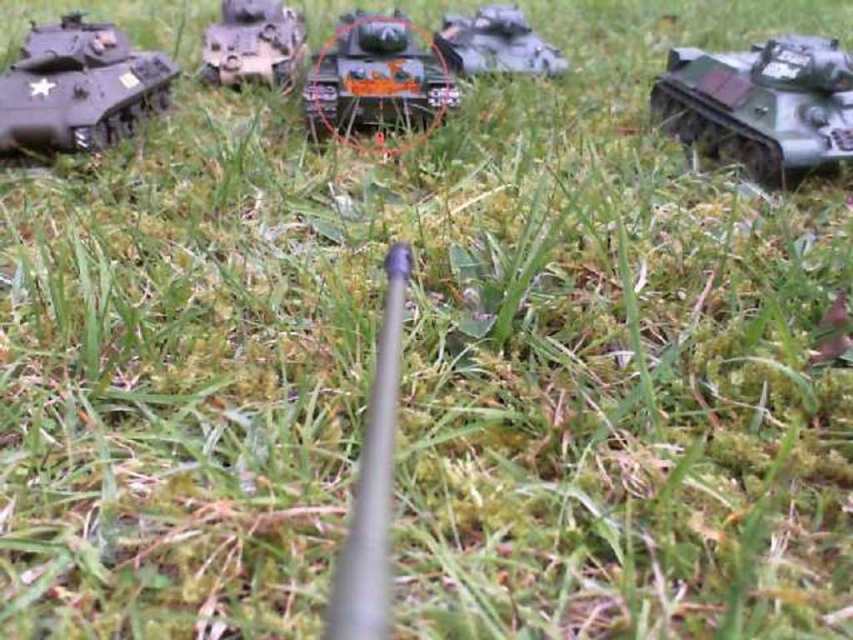
Question: Can you confirm if camouflage plastic tank at right is wider than metallic gun at center?

Choices:
 (A) yes
 (B) no

Answer: (A)

Question: Among these objects, which one is nearest to the camera?

Choices:
 (A) shiny orange tank at center
 (B) matte black tank at left

Answer: (B)

Question: Which point appears farthest from the camera in this image?

Choices:
 (A) (755, 106)
 (B) (521, 49)
 (C) (285, 17)
 (D) (386, 524)

Answer: (C)

Question: Which of the following is the farthest from the observer?

Choices:
 (A) (802, 104)
 (B) (74, 68)
 (C) (355, 45)
 (D) (476, 17)

Answer: (D)

Question: Considering the relative positions of matte black tank at left and metallic gun at center in the image provided, where is matte black tank at left located with respect to metallic gun at center?

Choices:
 (A) above
 (B) below

Answer: (A)

Question: Does camouflage plastic tank at right appear over metallic gun at center?

Choices:
 (A) yes
 (B) no

Answer: (A)